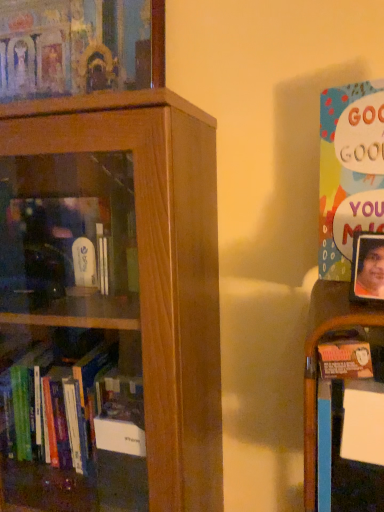
Image resolution: width=384 pixels, height=512 pixels. What are the coordinates of `brown wooden bookcase at left` in the screenshot? It's located at (159, 268).

The height and width of the screenshot is (512, 384). Describe the element at coordinates (159, 268) in the screenshot. I see `brown wooden bookcase at left` at that location.

This screenshot has height=512, width=384. Describe the element at coordinates (349, 172) in the screenshot. I see `multicolored paper poster at right, which ranks as the 1th book in right-to-left order` at that location.

Locate an element on the screen. matte wooden frame at upper left, which is counted as the second book, starting from the bottom is located at coordinates (80, 47).

You are a GUI agent. You are given a task and a screenshot of the screen. Output one action in this format:
    pyautogui.click(x=<x>, y=<y>)
    Task: Click on the wooden shelf at right
    This screenshot has height=512, width=384.
    Given the screenshot: What is the action you would take?
    pyautogui.click(x=316, y=360)

From the image's perspective, which is below, matte wooden frame at upper left, the 1th book in the back-to-front sequence, or multicolored paper poster at right, the 2th book viewed from the left?

multicolored paper poster at right, the 2th book viewed from the left, from the image's perspective.

How many degrees apart are the facing directions of matte wooden frame at upper left, which is counted as the second book, starting from the bottom, and multicolored paper poster at right, the second book positioned from the back?

24.2 degrees.

Who is taller, matte wooden frame at upper left, the 1th book in the back-to-front sequence, or multicolored paper poster at right, which is counted as the second book, starting from the top?

multicolored paper poster at right, which is counted as the second book, starting from the top.

Between point (311, 396) and point (350, 254), which one is positioned in front?

Point (311, 396)

From a real-world perspective, is wooden shelf at right over multicolored paper poster at right, which ranks as the 1th book in right-to-left order?

No, from a real-world perspective, wooden shelf at right is not over multicolored paper poster at right, which ranks as the 1th book in right-to-left order

Image resolution: width=384 pixels, height=512 pixels. I want to click on shelf that appears on the left of multicolored paper poster at right, which is the 1th book in bottom-to-top order, so click(316, 360).

Consider the image. Is wooden shelf at right behind multicolored paper poster at right, the 2th book viewed from the left?

Yes, wooden shelf at right is further from the camera.

Considering the sizes of brown wooden bookcase at left and matte wooden frame at upper left, acting as the 1th book starting from the top, in the image, is brown wooden bookcase at left taller or shorter than matte wooden frame at upper left, acting as the 1th book starting from the top,?

In the image, brown wooden bookcase at left appears to be taller than matte wooden frame at upper left, acting as the 1th book starting from the top.

Which object is closer to the camera, brown wooden bookcase at left or matte wooden frame at upper left, which is the 2th book from front to back?

brown wooden bookcase at left is in front.

Are brown wooden bookcase at left and matte wooden frame at upper left, acting as the 1th book starting from the top, beside each other?

There is a gap between brown wooden bookcase at left and matte wooden frame at upper left, acting as the 1th book starting from the top.

From a real-world perspective, is brown wooden bookcase at left above or below matte wooden frame at upper left, which is the 2th book from front to back?

In terms of real-world spatial position, brown wooden bookcase at left is below matte wooden frame at upper left, which is the 2th book from front to back.

What's the angular difference between matte wooden frame at upper left, the 2th book viewed from the right, and brown wooden bookcase at left's facing directions?

1.38 degrees.

Is matte wooden frame at upper left, acting as the 1th book starting from the top, taller than brown wooden bookcase at left?

Incorrect, the height of matte wooden frame at upper left, acting as the 1th book starting from the top, is not larger of that of brown wooden bookcase at left.

Considering the relative positions of matte wooden frame at upper left, which is the 1th book in left-to-right order, and brown wooden bookcase at left in the image provided, is matte wooden frame at upper left, which is the 1th book in left-to-right order, behind brown wooden bookcase at left?

Yes, the depth of matte wooden frame at upper left, which is the 1th book in left-to-right order, is greater than that of brown wooden bookcase at left.

Based on the photo, is matte wooden frame at upper left, which is the 1th book in left-to-right order, directly adjacent to brown wooden bookcase at left?

No, matte wooden frame at upper left, which is the 1th book in left-to-right order, is not making contact with brown wooden bookcase at left.

What's the angular difference between brown wooden bookcase at left and multicolored paper poster at right, which ranks as the 1th book in right-to-left order,'s facing directions?

The facing directions of brown wooden bookcase at left and multicolored paper poster at right, which ranks as the 1th book in right-to-left order, are 25.5 degrees apart.

From a real-world perspective, which is physically below, brown wooden bookcase at left or multicolored paper poster at right, which is counted as the second book, starting from the top?

In real-world perspective, brown wooden bookcase at left is lower.

Is brown wooden bookcase at left shorter than multicolored paper poster at right, the 2th book viewed from the left?

In fact, brown wooden bookcase at left may be taller than multicolored paper poster at right, the 2th book viewed from the left.

Who is smaller, brown wooden bookcase at left or multicolored paper poster at right, the 2th book viewed from the left?

With smaller size is multicolored paper poster at right, the 2th book viewed from the left.

Does point (377, 148) appear closer or farther from the camera than point (307, 467)?

Point (377, 148) is farther from the camera than point (307, 467).

Which is more to the left, multicolored paper poster at right, the first book viewed from the front, or wooden shelf at right?

Positioned to the left is wooden shelf at right.

Looking at this image, does multicolored paper poster at right, which is the 1th book in bottom-to-top order, come behind wooden shelf at right?

No, multicolored paper poster at right, which is the 1th book in bottom-to-top order, is closer to the camera.

Which object is closer to the camera taking this photo, wooden shelf at right or matte wooden frame at upper left, the 2th book viewed from the right?

wooden shelf at right is more forward.

How distant is wooden shelf at right from matte wooden frame at upper left, which is the 2th book from front to back?

wooden shelf at right and matte wooden frame at upper left, which is the 2th book from front to back, are 70.20 centimeters apart from each other.

Is wooden shelf at right not near matte wooden frame at upper left, the 2th book viewed from the right?

wooden shelf at right is actually quite close to matte wooden frame at upper left, the 2th book viewed from the right.

From a real-world perspective, is wooden shelf at right positioned under matte wooden frame at upper left, which is the 1th book in left-to-right order, based on gravity?

Correct, in the physical world, wooden shelf at right is lower than matte wooden frame at upper left, which is the 1th book in left-to-right order.

The image size is (384, 512). What are the coordinates of `book below the matte wooden frame at upper left, the 2th book viewed from the right (from a real-world perspective)` in the screenshot? It's located at (349, 172).

In order to click on book that is the 1st object above the wooden shelf at right (from a real-world perspective) in this screenshot , I will do `click(349, 172)`.

Considering their positions, is wooden shelf at right positioned further to brown wooden bookcase at left than matte wooden frame at upper left, which is the 1th book in left-to-right order?

Among the two, matte wooden frame at upper left, which is the 1th book in left-to-right order, is located further to brown wooden bookcase at left.

From the image, which object appears to be farther from matte wooden frame at upper left, which is the 1th book in left-to-right order, wooden shelf at right or multicolored paper poster at right, which is the 1th book in bottom-to-top order?

wooden shelf at right is further to matte wooden frame at upper left, which is the 1th book in left-to-right order.

Which object lies nearer to the anchor point matte wooden frame at upper left, which is the 1th book in left-to-right order, multicolored paper poster at right, which is counted as the second book, starting from the top, or brown wooden bookcase at left?

Among the two, brown wooden bookcase at left is located nearer to matte wooden frame at upper left, which is the 1th book in left-to-right order.

Looking at the image, which one is located further to multicolored paper poster at right, which is counted as the second book, starting from the top, matte wooden frame at upper left, which is counted as the second book, starting from the bottom, or brown wooden bookcase at left?

matte wooden frame at upper left, which is counted as the second book, starting from the bottom, is further to multicolored paper poster at right, which is counted as the second book, starting from the top.

Looking at the image, which one is located further to brown wooden bookcase at left, wooden shelf at right or multicolored paper poster at right, the second book positioned from the back?

Among the two, multicolored paper poster at right, the second book positioned from the back, is located further to brown wooden bookcase at left.

From the image, which object appears to be nearer to brown wooden bookcase at left, multicolored paper poster at right, which is the 1th book in bottom-to-top order, or wooden shelf at right?

Based on the image, wooden shelf at right appears to be nearer to brown wooden bookcase at left.

Estimate the real-world distances between objects in this image. Which object is further from multicolored paper poster at right, which is the 1th book in bottom-to-top order, wooden shelf at right or brown wooden bookcase at left?

The object further to multicolored paper poster at right, which is the 1th book in bottom-to-top order, is brown wooden bookcase at left.

Looking at the image, which one is located further to brown wooden bookcase at left, multicolored paper poster at right, the first book viewed from the front, or matte wooden frame at upper left, acting as the 1th book starting from the top?

matte wooden frame at upper left, acting as the 1th book starting from the top, is further to brown wooden bookcase at left.

Where is `book between matte wooden frame at upper left, the 2th book viewed from the right, and wooden shelf at right, in the vertical direction`? book between matte wooden frame at upper left, the 2th book viewed from the right, and wooden shelf at right, in the vertical direction is located at coordinates (349, 172).

Locate an element on the screen. This screenshot has width=384, height=512. shelf between brown wooden bookcase at left and multicolored paper poster at right, which ranks as the 1th book in right-to-left order, in the horizontal direction is located at coordinates (316, 360).

This screenshot has height=512, width=384. Identify the location of shelf between matte wooden frame at upper left, acting as the 1th book starting from the top, and brown wooden bookcase at left vertically. (316, 360).

At what (x,y) coordinates should I click in order to perform the action: click on book between matte wooden frame at upper left, the 2th book viewed from the right, and brown wooden bookcase at left from top to bottom. Please return your answer as a coordinate pair (x, y). This screenshot has width=384, height=512. Looking at the image, I should click on (349, 172).